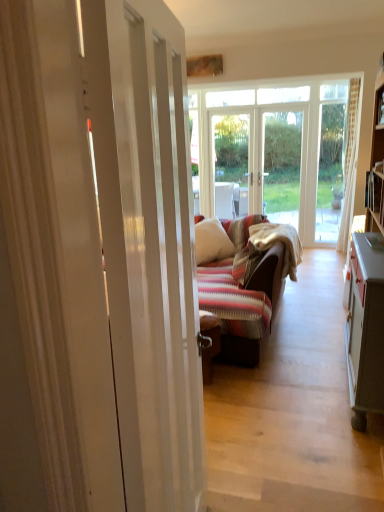
Question: From a real-world perspective, does white glossy door at center stand above white soft pillow at center?

Choices:
 (A) yes
 (B) no

Answer: (A)

Question: Is white glossy door at center positioned with its back to white soft pillow at center?

Choices:
 (A) yes
 (B) no

Answer: (B)

Question: Can you confirm if white glossy door at center is smaller than white soft pillow at center?

Choices:
 (A) no
 (B) yes

Answer: (A)

Question: Is white glossy door at center next to white soft pillow at center and touching it?

Choices:
 (A) yes
 (B) no

Answer: (B)

Question: Is white glossy door at center far away from white soft pillow at center?

Choices:
 (A) yes
 (B) no

Answer: (A)

Question: From a real-world perspective, is white glossy door at center below white soft pillow at center?

Choices:
 (A) no
 (B) yes

Answer: (A)

Question: Is white soft pillow at center not inside white glossy door at center?

Choices:
 (A) no
 (B) yes

Answer: (B)

Question: Considering the relative sizes of white soft pillow at center and white glossy door at center in the image provided, is white soft pillow at center shorter than white glossy door at center?

Choices:
 (A) no
 (B) yes

Answer: (B)

Question: Can you confirm if white soft pillow at center is smaller than white glossy door at center?

Choices:
 (A) no
 (B) yes

Answer: (B)

Question: From a real-world perspective, does white soft pillow at center sit lower than white glossy door at center?

Choices:
 (A) yes
 (B) no

Answer: (A)

Question: Is white soft pillow at center wider than white glossy door at center?

Choices:
 (A) yes
 (B) no

Answer: (A)

Question: Could you tell me if white soft pillow at center is facing white glossy door at center?

Choices:
 (A) yes
 (B) no

Answer: (A)

Question: Does point (148, 13) appear closer or farther from the camera than point (233, 253)?

Choices:
 (A) closer
 (B) farther

Answer: (A)